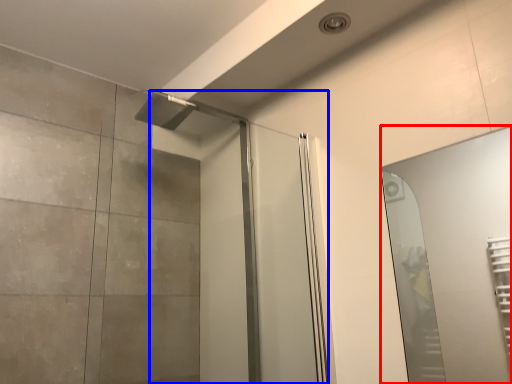
Question: Which object is further to the camera taking this photo, mirror (highlighted by a red box) or screen door (highlighted by a blue box)?

Choices:
 (A) mirror
 (B) screen door

Answer: (B)